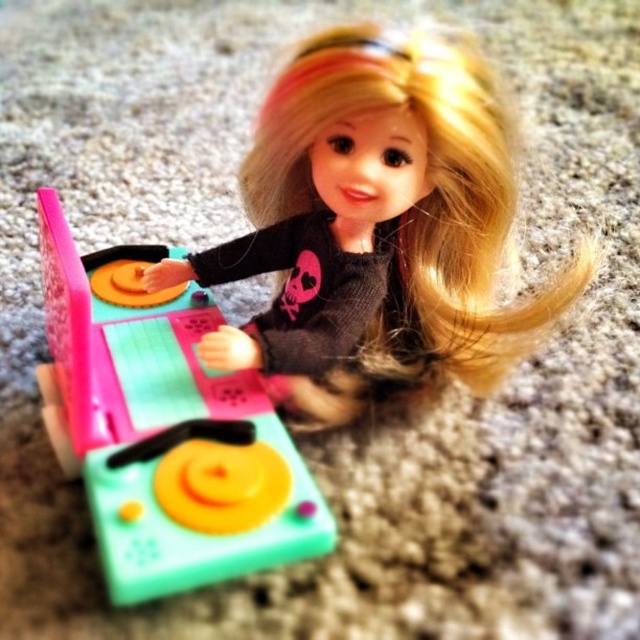
Is black matte doll at center smaller than matte plastic turntable at center?

Actually, black matte doll at center might be larger than matte plastic turntable at center.

Between point (371, 336) and point (294, 544), which one is positioned in front?

Point (294, 544)

Identify the location of black matte doll at center. (394, 216).